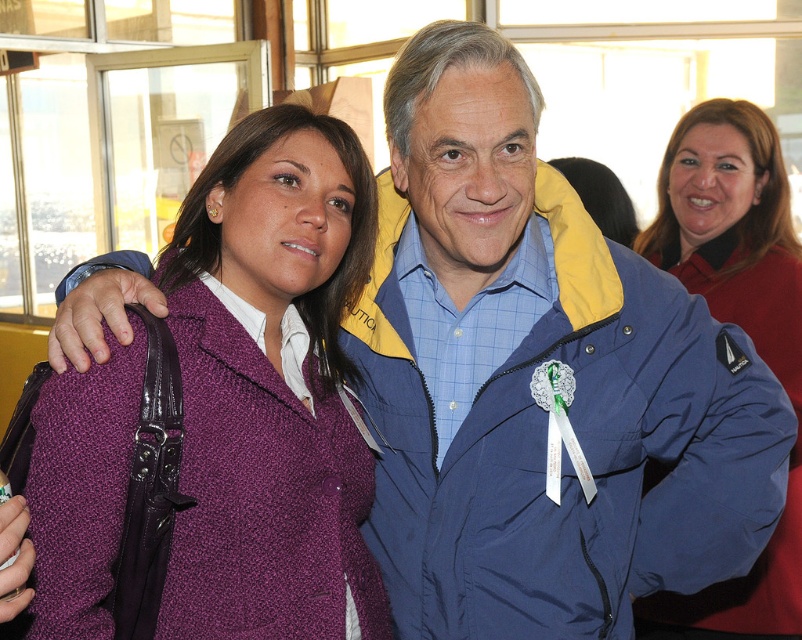
This screenshot has width=802, height=640. What do you see at coordinates (738, 324) in the screenshot?
I see `matte red shirt at upper right` at bounding box center [738, 324].

I want to click on matte red shirt at upper right, so click(x=738, y=324).

What do you see at coordinates (738, 324) in the screenshot? The image size is (802, 640). I see `matte red shirt at upper right` at bounding box center [738, 324].

Image resolution: width=802 pixels, height=640 pixels. Find the location of `matte red shirt at upper right`. matte red shirt at upper right is located at coordinates (738, 324).